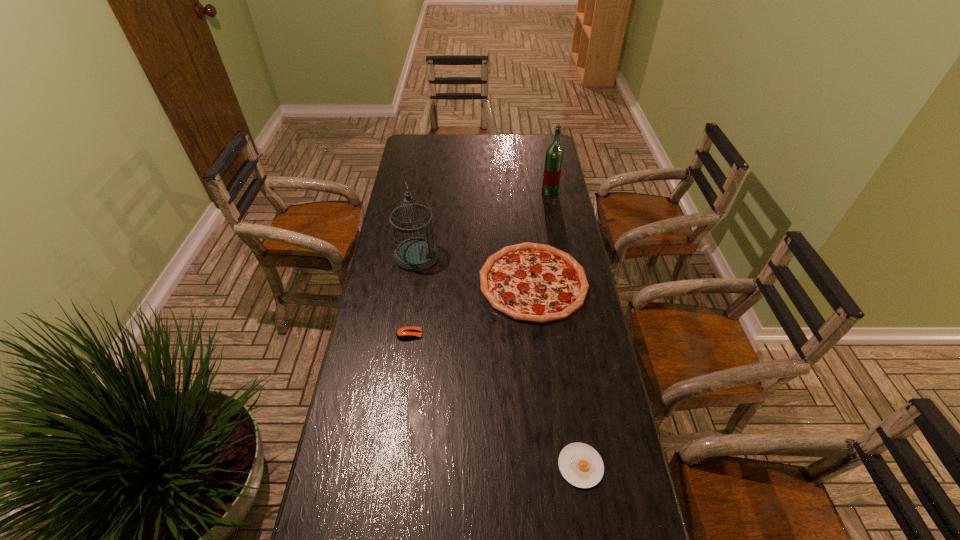
This screenshot has width=960, height=540. I want to click on vacant space that's between the liquor and the second shortest object, so click(x=480, y=263).

Select which object appears as the fourth closest to the liquor. Please provide its 2D coordinates. Your answer should be formatted as a tuple, i.e. [(x, y)], where the tuple contains the x and y coordinates of a point satisfying the conditions above.

[(581, 465)]

Identify the location of object identified as the fourth closest to the egg yolk. This screenshot has height=540, width=960. (554, 154).

Identify the location of vacant space that satisfies the following two spatial constraints: 1. on the front-facing side of the third tallest object; 2. on the right side of the birdcage. This screenshot has height=540, width=960. (413, 282).

Identify the location of vacant position in the image that satisfies the following two spatial constraints: 1. on the back side of the farthest object; 2. on the left side of the computer mouse. (429, 192).

You are a GUI agent. You are given a task and a screenshot of the screen. Output one action in this format:
    pyautogui.click(x=<x>, y=<y>)
    Task: Click on the free space that satisfies the following two spatial constraints: 1. on the back side of the second nearest object; 2. on the left side of the liquor
    Image resolution: width=960 pixels, height=540 pixels.
    Given the screenshot: What is the action you would take?
    pyautogui.click(x=429, y=192)

I want to click on free spot that satisfies the following two spatial constraints: 1. on the front side of the fourth tallest object; 2. on the right side of the nearest object, so click(x=392, y=465).